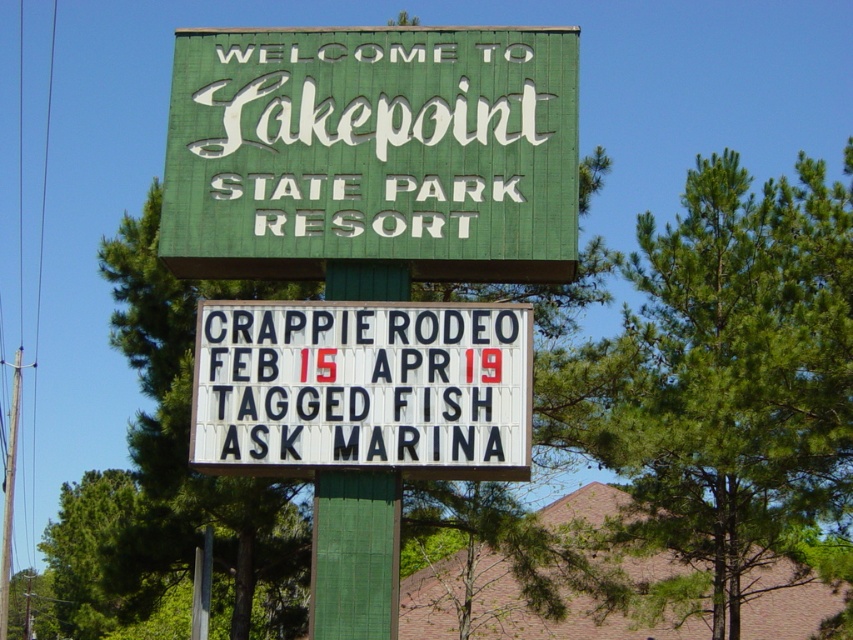
Which is more to the right, green painted wood signboard at upper center or green painted wood pole at center?

green painted wood signboard at upper center

This screenshot has height=640, width=853. What do you see at coordinates (372, 152) in the screenshot?
I see `green painted wood signboard at upper center` at bounding box center [372, 152].

The image size is (853, 640). I want to click on green painted wood signboard at upper center, so click(372, 152).

Does green painted wood signboard at upper center appear under white plastic letters at center?

No.

Can you confirm if green painted wood signboard at upper center is thinner than white plastic letters at center?

Incorrect, green painted wood signboard at upper center's width is not less than white plastic letters at center's.

Between point (296, 164) and point (236, 444), which one is positioned in front?

Point (236, 444) is more forward.

At what (x,y) coordinates should I click in order to perform the action: click on green painted wood signboard at upper center. Please return your answer as a coordinate pair (x, y). The image size is (853, 640). Looking at the image, I should click on (372, 152).

Is white plastic letters at center taller than green painted wood pole at center?

No.

Which is behind, point (357, 435) or point (325, 545)?

The point (325, 545) is behind.

Between point (294, 344) and point (363, 483), which one is positioned behind?

Point (294, 344)

This screenshot has height=640, width=853. In order to click on white plastic letters at center in this screenshot , I will do `click(363, 387)`.